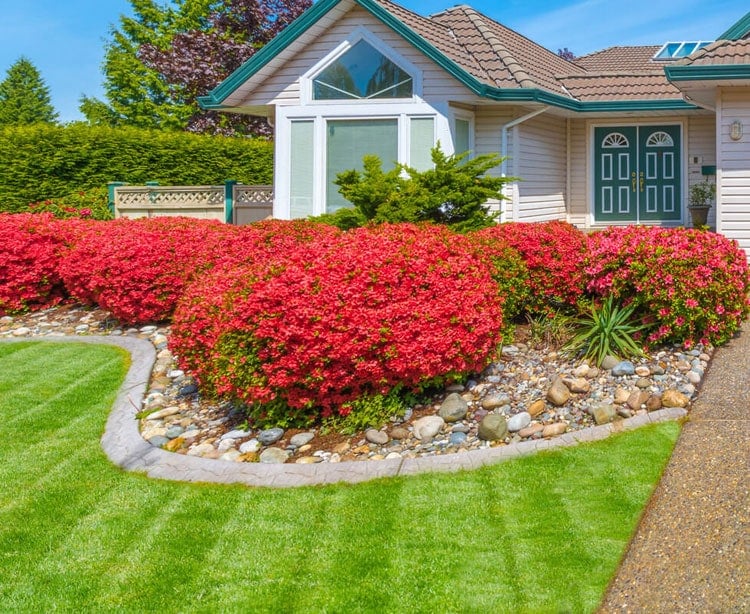
Locate an element on the screen. This screenshot has width=750, height=614. handle is located at coordinates (640, 177), (630, 177).